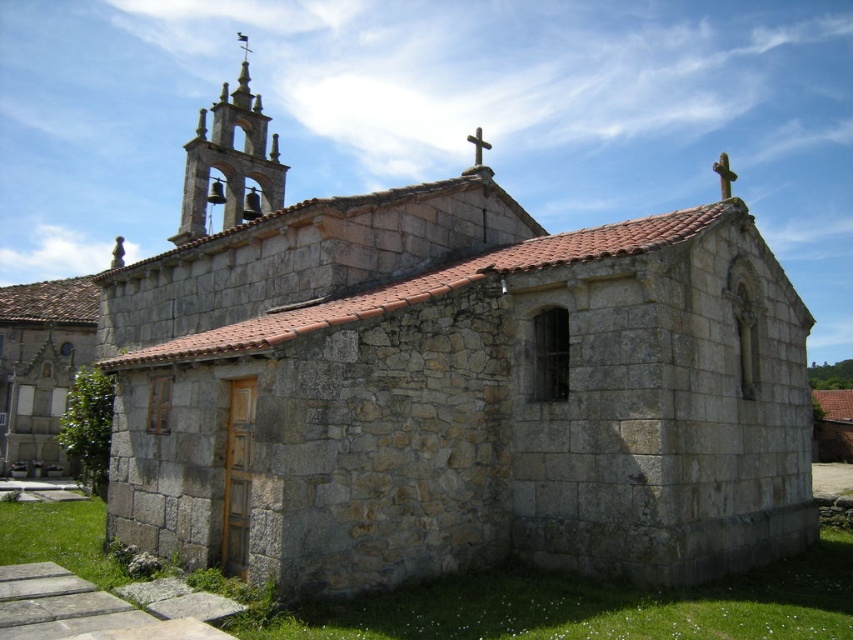
Question: Does stone bell tower at upper left appear on the right side of metallic cross at upper center?

Choices:
 (A) yes
 (B) no

Answer: (A)

Question: Which of these objects is positioned farthest from the stone bell tower at upper left?

Choices:
 (A) metallic cross at center
 (B) metallic cross at upper center
 (C) smooth stone cross at upper right

Answer: (C)

Question: Which object is the farthest from the metallic cross at upper center?

Choices:
 (A) metallic cross at center
 (B) stone bell tower at upper left
 (C) smooth stone cross at upper right

Answer: (C)

Question: Does smooth stone cross at upper right appear over metallic cross at upper center?

Choices:
 (A) yes
 (B) no

Answer: (B)

Question: Which of the following is the farthest from the observer?

Choices:
 (A) (239, 42)
 (B) (273, 145)
 (C) (477, 145)
 (D) (722, 163)

Answer: (B)

Question: Is smooth stone cross at upper right above metallic cross at center?

Choices:
 (A) no
 (B) yes

Answer: (B)